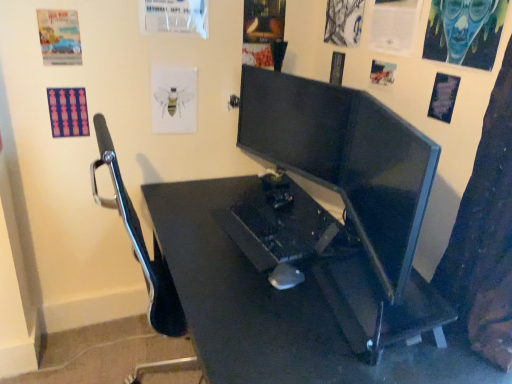
Question: Does black plastic desk at center have a smaller size compared to black plastic mouse at center?

Choices:
 (A) no
 (B) yes

Answer: (A)

Question: From a real-world perspective, is black plastic desk at center on top of black plastic mouse at center?

Choices:
 (A) yes
 (B) no

Answer: (B)

Question: Considering the relative positions of black plastic desk at center and black plastic mouse at center in the image provided, is black plastic desk at center to the left of black plastic mouse at center from the viewer's perspective?

Choices:
 (A) yes
 (B) no

Answer: (A)

Question: From the image's perspective, does black plastic desk at center appear lower than black plastic mouse at center?

Choices:
 (A) yes
 (B) no

Answer: (A)

Question: Is black plastic desk at center bigger than black plastic mouse at center?

Choices:
 (A) yes
 (B) no

Answer: (A)

Question: In terms of width, does matte paper poster at upper left, which is counted as the 8th poster page, starting from the right, look wider or thinner when compared to white paper at upper center, the sixth poster page in the right-to-left sequence?

Choices:
 (A) wide
 (B) thin

Answer: (B)

Question: From the image's perspective, is matte paper poster at upper left, the second poster page viewed from the left, positioned above or below white paper at upper center, the sixth poster page in the right-to-left sequence?

Choices:
 (A) above
 (B) below

Answer: (B)

Question: Visually, is matte paper poster at upper left, which is counted as the 8th poster page, starting from the right, positioned to the left or to the right of white paper at upper center, the sixth poster page in the right-to-left sequence?

Choices:
 (A) left
 (B) right

Answer: (A)

Question: From a real-world perspective, relative to white paper at upper center, the sixth poster page in the right-to-left sequence, is matte paper poster at upper left, which is counted as the 8th poster page, starting from the right, vertically above or below?

Choices:
 (A) below
 (B) above

Answer: (A)

Question: From the image's perspective, is matte paper poster at upper left, the second poster page viewed from the left, above or below charcoal sketch at upper right, the 5th poster page from the right?

Choices:
 (A) below
 (B) above

Answer: (A)

Question: Is point (60, 39) positioned closer to the camera than point (354, 29)?

Choices:
 (A) closer
 (B) farther

Answer: (A)

Question: From a real-world perspective, relative to charcoal sketch at upper right, which is the fifth poster page in left-to-right order, is matte paper poster at upper left, which is counted as the 8th poster page, starting from the right, vertically above or below?

Choices:
 (A) above
 (B) below

Answer: (B)

Question: Considering the positions of matte paper poster at upper left, which is counted as the 8th poster page, starting from the right, and charcoal sketch at upper right, the 5th poster page from the right, in the image, is matte paper poster at upper left, which is counted as the 8th poster page, starting from the right, wider or thinner than charcoal sketch at upper right, the 5th poster page from the right,?

Choices:
 (A) wide
 (B) thin

Answer: (B)

Question: Considering their positions, is pink fabric poster at upper left, the 1th poster page when ordered from left to right, located in front of or behind matte paper poster at upper right, arranged as the 6th poster page when viewed from the left?

Choices:
 (A) front
 (B) behind

Answer: (B)

Question: In terms of width, does pink fabric poster at upper left, the 1th poster page when ordered from left to right, look wider or thinner when compared to matte paper poster at upper right, arranged as the 6th poster page when viewed from the left?

Choices:
 (A) thin
 (B) wide

Answer: (B)